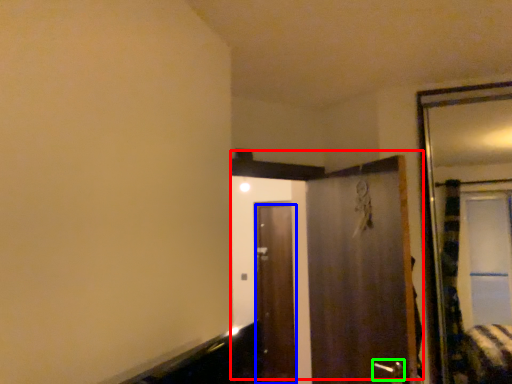
Question: Which object is the closest to the door (highlighted by a red box)? Choose among these: door (highlighted by a blue box) or door handle (highlighted by a green box).

Choices:
 (A) door
 (B) door handle

Answer: (B)